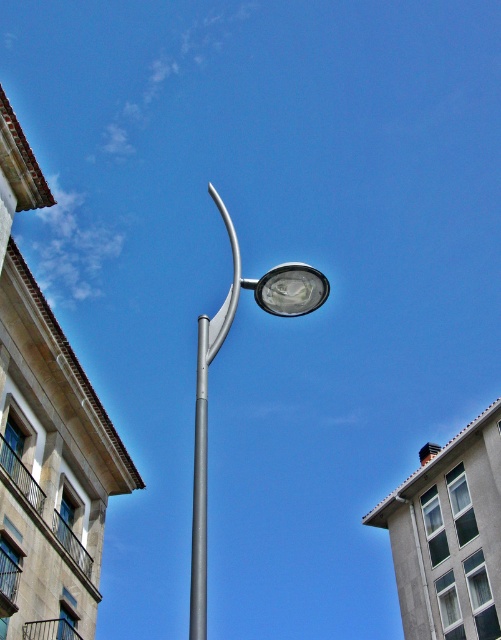
Which is in front, point (205, 538) or point (197, 444)?

Point (197, 444) is in front.

Is point (269, 291) closer to viewer compared to point (200, 401)?

That is False.

Which is in front, point (199, 348) or point (204, 404)?

Point (204, 404) is in front.

I want to click on metallic pole at center, so click(x=206, y=380).